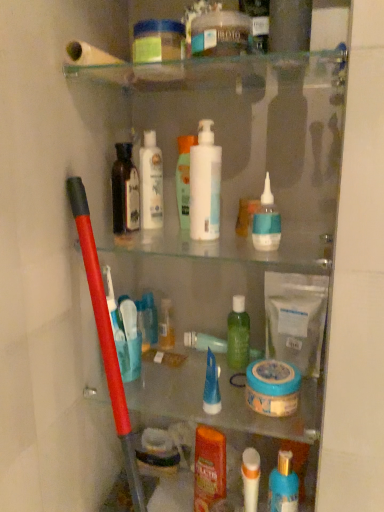
Question: From a real-world perspective, is blue gel tube at center, which is counted as the 5th toiletry, starting from the left, positioned under white glossy mouthwash at center, the first mouthwash viewed from the left, based on gravity?

Choices:
 (A) yes
 (B) no

Answer: (A)

Question: Is blue gel tube at center, the sixth toiletry from the right, closer to the viewer compared to white glossy mouthwash at center, the first mouthwash viewed from the left?

Choices:
 (A) no
 (B) yes

Answer: (B)

Question: Is blue gel tube at center, the sixth toiletry from the right, shorter than white glossy mouthwash at center, which is counted as the 2th mouthwash, starting from the right?

Choices:
 (A) yes
 (B) no

Answer: (A)

Question: Is blue gel tube at center, which is counted as the 5th toiletry, starting from the left, aimed at white glossy mouthwash at center, arranged as the second mouthwash when ordered from the bottom?

Choices:
 (A) yes
 (B) no

Answer: (B)

Question: From the image's perspective, is blue gel tube at center, the sixth toiletry from the right, located above white glossy mouthwash at center, which appears as the first mouthwash when viewed from the top?

Choices:
 (A) yes
 (B) no

Answer: (B)

Question: From the image's perspective, is blue gel tube at center, which is counted as the 5th toiletry, starting from the left, below white glossy mouthwash at center, the first mouthwash viewed from the left?

Choices:
 (A) no
 (B) yes

Answer: (B)

Question: Is white glossy mouthwash at center, the first mouthwash viewed from the left, a part of white glossy lotion at center, arranged as the second toiletry when viewed from the left?

Choices:
 (A) yes
 (B) no

Answer: (B)

Question: From a real-world perspective, is white glossy lotion at center, arranged as the second toiletry when viewed from the left, physically below white glossy mouthwash at center, arranged as the second mouthwash when ordered from the bottom?

Choices:
 (A) yes
 (B) no

Answer: (B)

Question: Does white glossy lotion at center, arranged as the second toiletry when viewed from the left, turn towards white glossy mouthwash at center, which is counted as the 2th mouthwash, starting from the right?

Choices:
 (A) no
 (B) yes

Answer: (A)

Question: Considering the relative sizes of white glossy lotion at center, arranged as the second toiletry when viewed from the left, and white glossy mouthwash at center, the first mouthwash viewed from the left, in the image provided, is white glossy lotion at center, arranged as the second toiletry when viewed from the left, taller than white glossy mouthwash at center, the first mouthwash viewed from the left,?

Choices:
 (A) no
 (B) yes

Answer: (B)

Question: Considering the relative positions of white glossy lotion at center, arranged as the second toiletry when viewed from the left, and white glossy mouthwash at center, arranged as the second mouthwash when ordered from the bottom, in the image provided, is white glossy lotion at center, arranged as the second toiletry when viewed from the left, to the right of white glossy mouthwash at center, arranged as the second mouthwash when ordered from the bottom, from the viewer's perspective?

Choices:
 (A) no
 (B) yes

Answer: (A)

Question: Considering the relative sizes of white glossy lotion at center, arranged as the second toiletry when viewed from the left, and white glossy mouthwash at center, which appears as the first mouthwash when viewed from the top, in the image provided, is white glossy lotion at center, arranged as the second toiletry when viewed from the left, shorter than white glossy mouthwash at center, which appears as the first mouthwash when viewed from the top,?

Choices:
 (A) no
 (B) yes

Answer: (A)

Question: Is the depth of green translucent bottle at center, acting as the seventh toiletry starting from the left, greater than that of dark brown glass bottle at upper left, the 1th toiletry in the left-to-right sequence?

Choices:
 (A) yes
 (B) no

Answer: (A)